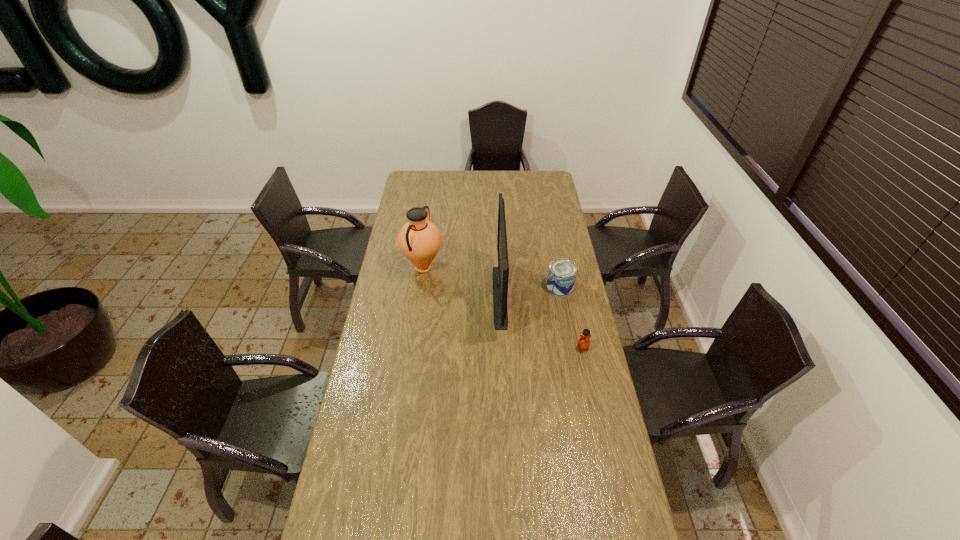
Image resolution: width=960 pixels, height=540 pixels. I want to click on the tallest object, so (x=500, y=275).

Image resolution: width=960 pixels, height=540 pixels. In order to click on the third object from right to left in this screenshot , I will do point(500,275).

Locate an element on the screen. the leftmost object is located at coordinates (419, 240).

Locate an element on the screen. The height and width of the screenshot is (540, 960). pitcher is located at coordinates (419, 240).

At what (x,y) coordinates should I click in order to perform the action: click on the second shortest object. Please return your answer as a coordinate pair (x, y). The height and width of the screenshot is (540, 960). Looking at the image, I should click on (562, 273).

The width and height of the screenshot is (960, 540). Find the location of `the nearest object`. the nearest object is located at coordinates (583, 344).

Where is `honey`? The height and width of the screenshot is (540, 960). honey is located at coordinates (583, 344).

The height and width of the screenshot is (540, 960). I want to click on vacant region located on the front-facing side of the monitor, so click(x=480, y=296).

Identify the location of free region located on the front-facing side of the monitor. This screenshot has width=960, height=540. (458, 296).

You are a GUI agent. You are given a task and a screenshot of the screen. Output one action in this format:
    pyautogui.click(x=<x>, y=<y>)
    Task: Click on the free space located on the front-facing side of the monitor
    
    Given the screenshot: What is the action you would take?
    pyautogui.click(x=465, y=296)